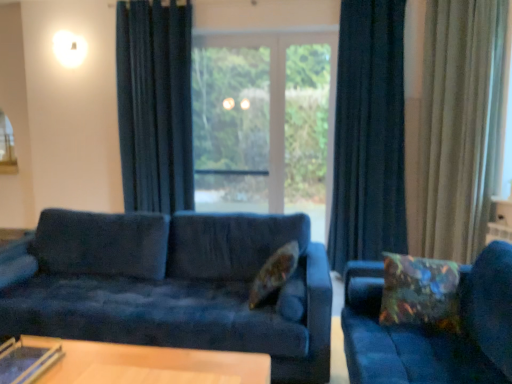
Question: Is floral fabric pillow at center, which is counted as the 1th pillow, starting from the left, closer to the viewer compared to transparent glass screen door at center?

Choices:
 (A) no
 (B) yes

Answer: (B)

Question: Is floral fabric pillow at center, marked as the 2th pillow in a right-to-left arrangement, to the left of transparent glass screen door at center from the viewer's perspective?

Choices:
 (A) yes
 (B) no

Answer: (A)

Question: Could you tell me if floral fabric pillow at center, marked as the 2th pillow in a right-to-left arrangement, is turned towards transparent glass screen door at center?

Choices:
 (A) no
 (B) yes

Answer: (A)

Question: Is floral fabric pillow at center, marked as the 2th pillow in a right-to-left arrangement, far from transparent glass screen door at center?

Choices:
 (A) no
 (B) yes

Answer: (B)

Question: Does floral fabric pillow at center, marked as the 2th pillow in a right-to-left arrangement, appear on the right side of transparent glass screen door at center?

Choices:
 (A) no
 (B) yes

Answer: (A)

Question: From their relative heights in the image, would you say multicolored fabric pillow at right, which appears as the 1th pillow when viewed from the right, is taller or shorter than transparent glass table at lower left?

Choices:
 (A) short
 (B) tall

Answer: (B)

Question: From the image's perspective, relative to transparent glass table at lower left, is multicolored fabric pillow at right, placed as the 2th pillow when sorted from left to right, above or below?

Choices:
 (A) below
 (B) above

Answer: (B)

Question: In the image, is multicolored fabric pillow at right, placed as the 2th pillow when sorted from left to right, positioned in front of or behind transparent glass table at lower left?

Choices:
 (A) front
 (B) behind

Answer: (B)

Question: Would you say multicolored fabric pillow at right, placed as the 2th pillow when sorted from left to right, is inside or outside transparent glass table at lower left?

Choices:
 (A) outside
 (B) inside

Answer: (A)

Question: Is point (47, 369) closer or farther from the camera than point (4, 309)?

Choices:
 (A) closer
 (B) farther

Answer: (A)

Question: In terms of height, does transparent glass table at lower left look taller or shorter compared to velvet blue couch at center, arranged as the 1th studio couch when viewed from the left?

Choices:
 (A) short
 (B) tall

Answer: (A)

Question: Considering the positions of transparent glass table at lower left and velvet blue couch at center, arranged as the 1th studio couch when viewed from the left, in the image, is transparent glass table at lower left bigger or smaller than velvet blue couch at center, arranged as the 1th studio couch when viewed from the left,?

Choices:
 (A) big
 (B) small

Answer: (B)

Question: From the image's perspective, is transparent glass table at lower left positioned above or below velvet blue couch at center, the 2th studio couch positioned from the right?

Choices:
 (A) above
 (B) below

Answer: (B)

Question: From a real-world perspective, is multicolored fabric pillow at right, placed as the 2th pillow when sorted from left to right, physically located above or below beige velvet curtain at right, which is the first curtain in right-to-left order?

Choices:
 (A) above
 (B) below

Answer: (B)

Question: Considering the positions of multicolored fabric pillow at right, which appears as the 1th pillow when viewed from the right, and beige velvet curtain at right, which is the first curtain in right-to-left order, in the image, is multicolored fabric pillow at right, which appears as the 1th pillow when viewed from the right, wider or thinner than beige velvet curtain at right, which is the first curtain in right-to-left order,?

Choices:
 (A) thin
 (B) wide

Answer: (B)